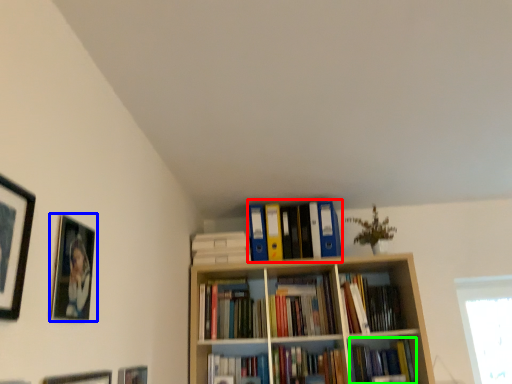
Question: Which object is the farthest from book (highlighted by a red box)? Choose among these: picture frame (highlighted by a blue box) or book (highlighted by a green box).

Choices:
 (A) picture frame
 (B) book

Answer: (A)